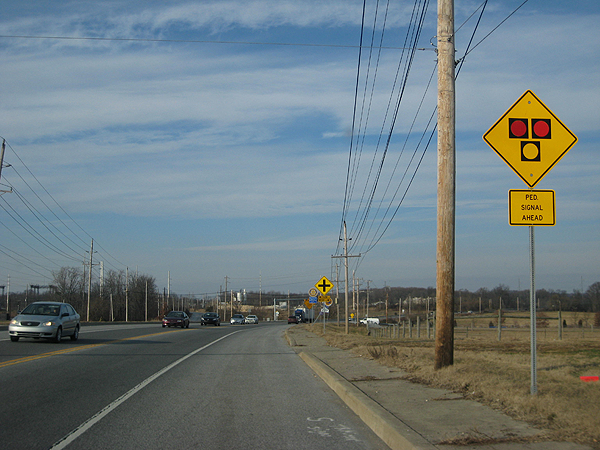
Where is `window`? This screenshot has width=600, height=450. window is located at coordinates (39, 311).